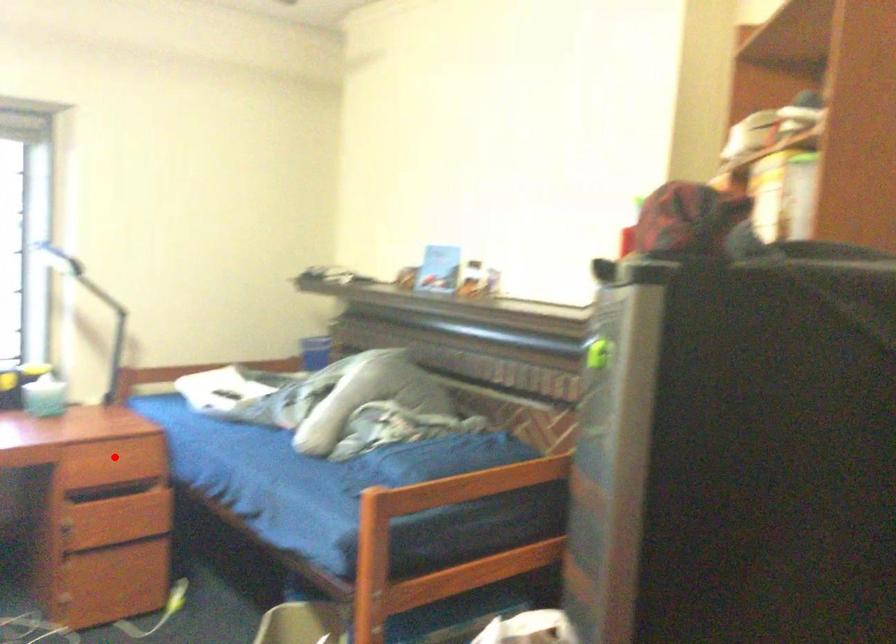
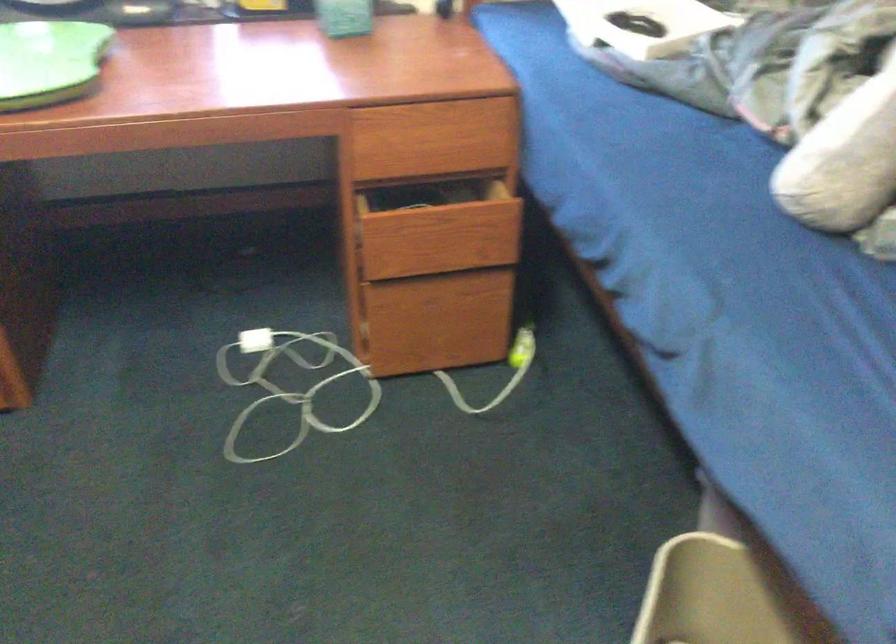
Where in the second image is the point corresponding to the highlighted location from the first image?

(435, 136)